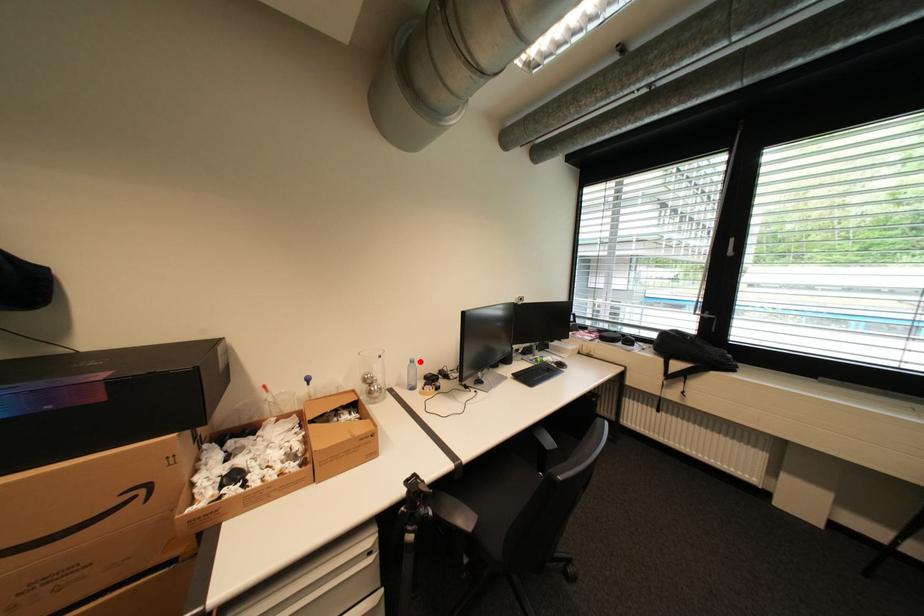
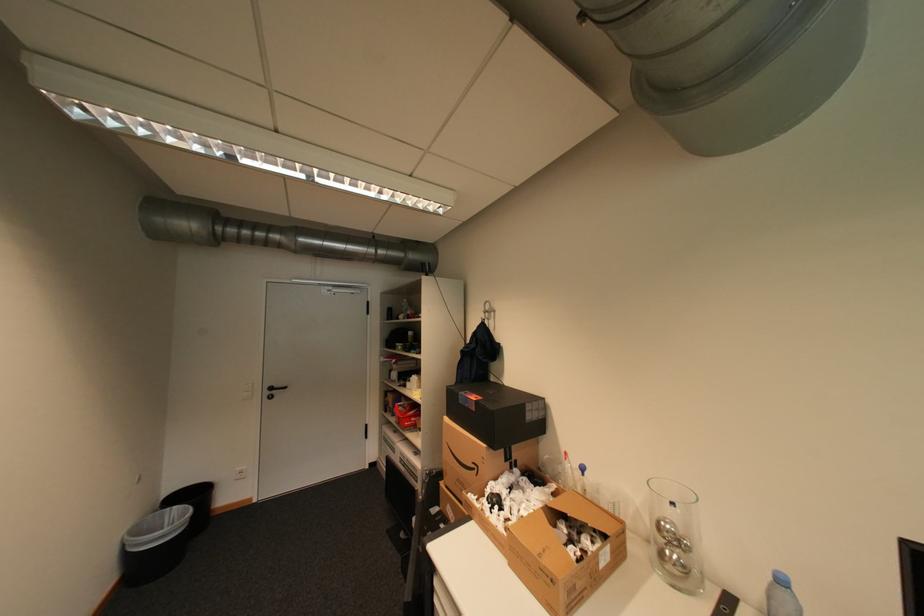
Question: I am providing you with two images of the same scene from different viewpoints. Image1 has a red point marked. In image2, the corresponding 3D location appears at what relative position? Reply with the corresponding letter.

Choices:
 (A) Closer
 (B) Farther

Answer: (B)